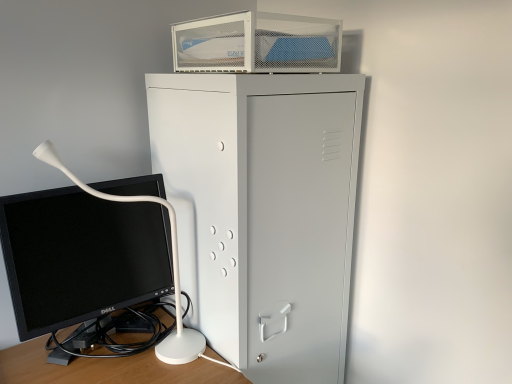
Question: Does metal mesh container at upper center have a larger size compared to metallic gray cabinet at center?

Choices:
 (A) yes
 (B) no

Answer: (B)

Question: Considering the relative sizes of metal mesh container at upper center and metallic gray cabinet at center in the image provided, is metal mesh container at upper center thinner than metallic gray cabinet at center?

Choices:
 (A) yes
 (B) no

Answer: (A)

Question: Considering the relative sizes of metal mesh container at upper center and metallic gray cabinet at center in the image provided, is metal mesh container at upper center smaller than metallic gray cabinet at center?

Choices:
 (A) no
 (B) yes

Answer: (B)

Question: Is metallic gray cabinet at center located within metal mesh container at upper center?

Choices:
 (A) no
 (B) yes

Answer: (A)

Question: Is the depth of metal mesh container at upper center greater than that of metallic gray cabinet at center?

Choices:
 (A) no
 (B) yes

Answer: (B)

Question: Is metallic gray cabinet at center to the left or to the right of black glossy computer monitor at lower left in the image?

Choices:
 (A) right
 (B) left

Answer: (A)

Question: In terms of height, does metallic gray cabinet at center look taller or shorter compared to black glossy computer monitor at lower left?

Choices:
 (A) short
 (B) tall

Answer: (B)

Question: Is metallic gray cabinet at center wider or thinner than black glossy computer monitor at lower left?

Choices:
 (A) thin
 (B) wide

Answer: (B)

Question: From the image's perspective, is metallic gray cabinet at center above or below black glossy computer monitor at lower left?

Choices:
 (A) below
 (B) above

Answer: (A)

Question: From their relative heights in the image, would you say black glossy computer monitor at lower left is taller or shorter than metal mesh container at upper center?

Choices:
 (A) short
 (B) tall

Answer: (B)

Question: Visually, is black glossy computer monitor at lower left positioned to the left or to the right of metal mesh container at upper center?

Choices:
 (A) left
 (B) right

Answer: (A)

Question: Do you think black glossy computer monitor at lower left is within metal mesh container at upper center, or outside of it?

Choices:
 (A) inside
 (B) outside

Answer: (B)

Question: In terms of width, does black glossy computer monitor at lower left look wider or thinner when compared to metal mesh container at upper center?

Choices:
 (A) thin
 (B) wide

Answer: (A)

Question: From the image's perspective, is black glossy computer monitor at lower left located above or below metallic gray cabinet at center?

Choices:
 (A) above
 (B) below

Answer: (A)

Question: Would you say black glossy computer monitor at lower left is to the left or to the right of metallic gray cabinet at center in the picture?

Choices:
 (A) right
 (B) left

Answer: (B)